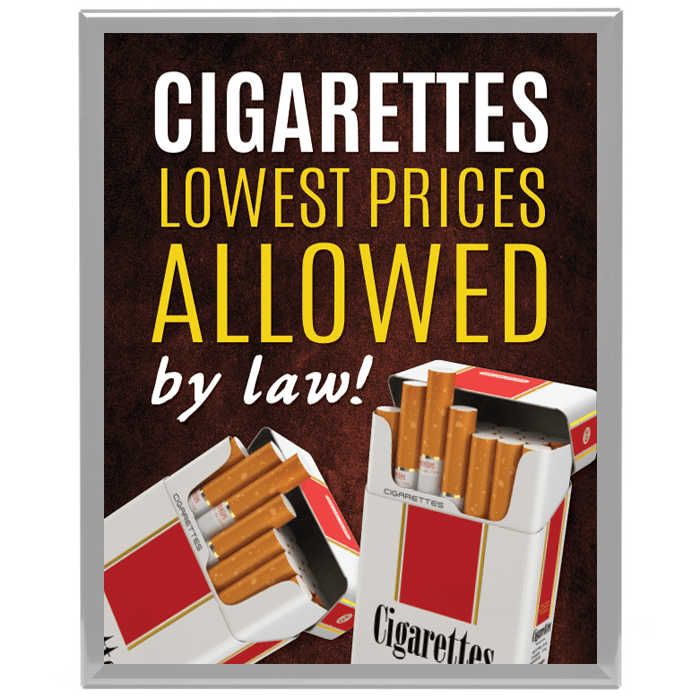
Image resolution: width=700 pixels, height=700 pixels. I want to click on poster frame, so click(x=90, y=598).